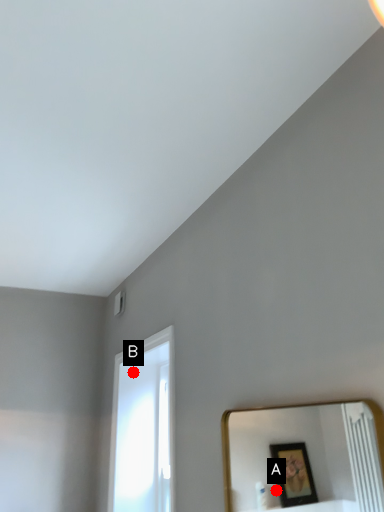
Question: Two points are circled on the image, labeled by A and B beside each circle. Which of the following is the farthest from the observer?

Choices:
 (A) A is further
 (B) B is further

Answer: (A)